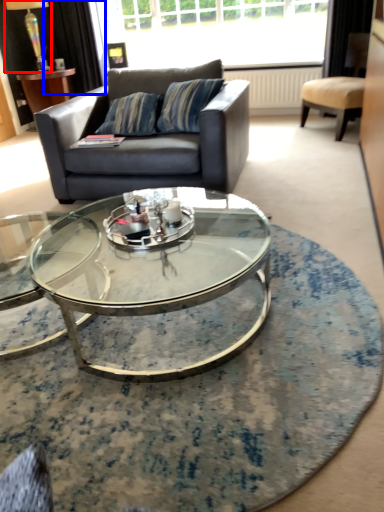
Question: Which point is further to the camera, lamp (highlighted by a red box) or curtain (highlighted by a blue box)?

Choices:
 (A) lamp
 (B) curtain

Answer: (B)